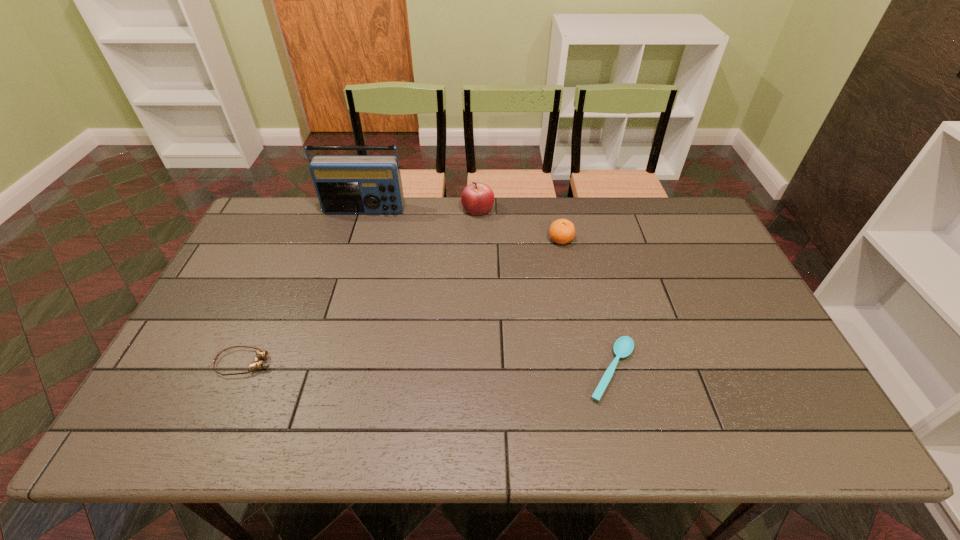
Identify the location of the tallest object. This screenshot has width=960, height=540. (345, 184).

Locate an element on the screen. apple is located at coordinates (477, 198).

Image resolution: width=960 pixels, height=540 pixels. Find the location of `the third object from left to right`. the third object from left to right is located at coordinates [x=477, y=198].

This screenshot has height=540, width=960. What are the coordinates of `the third nearest object` in the screenshot? It's located at (562, 231).

Where is `the third shortest object`? The height and width of the screenshot is (540, 960). the third shortest object is located at coordinates (562, 231).

You are a GUI agent. You are given a task and a screenshot of the screen. Output one action in this format:
    pyautogui.click(x=<x>, y=<y>)
    Task: Click on the goggles
    Image resolution: width=960 pixels, height=540 pixels.
    Given the screenshot: What is the action you would take?
    pyautogui.click(x=260, y=354)

Where is `the shortest object`? The image size is (960, 540). the shortest object is located at coordinates (623, 347).

You are a GUI agent. You are given a task and a screenshot of the screen. Output one action in this format:
    pyautogui.click(x=<x>, y=<y>)
    Task: Click on the free spot located 0.200m on the front panel of the tallest object
    This screenshot has height=540, width=960.
    Given the screenshot: What is the action you would take?
    point(349,256)

The width and height of the screenshot is (960, 540). I want to click on blank space located 0.280m on the right of the fourth shortest object, so click(574, 209).

Where is `free space located 0.160m on the front of the third shortest object`? Image resolution: width=960 pixels, height=540 pixels. free space located 0.160m on the front of the third shortest object is located at coordinates (569, 285).